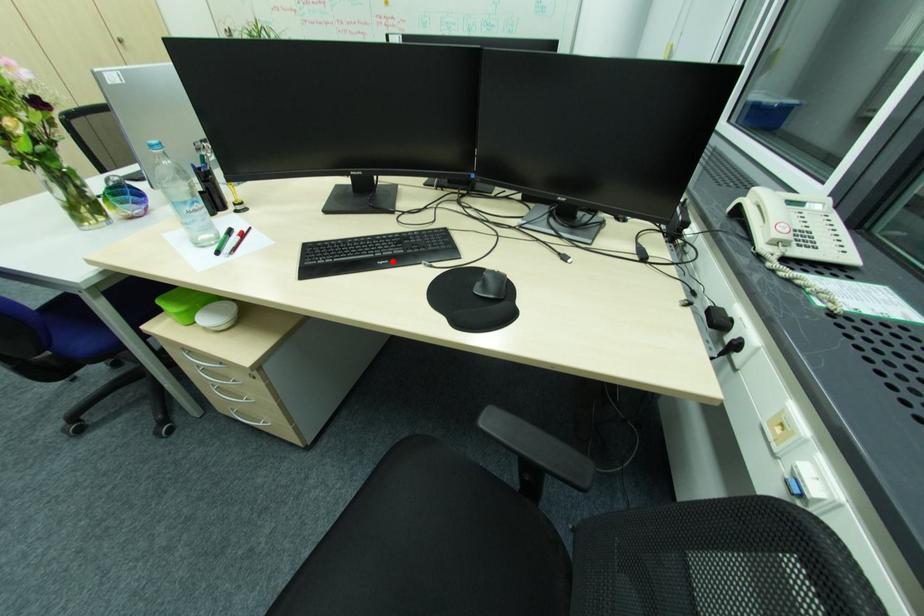
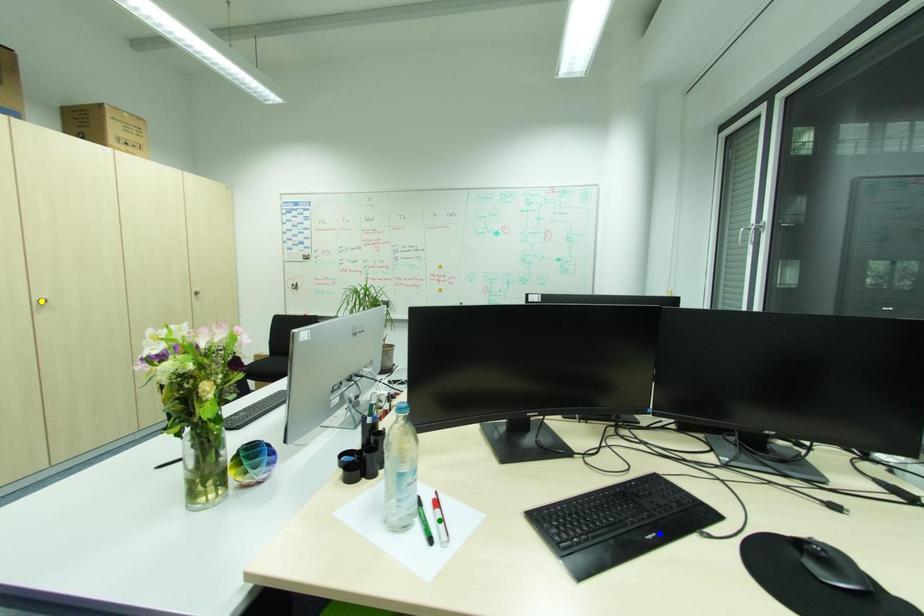
Question: I am providing you with two images of the same scene from different viewpoints. A red point is marked on the first image. You are given multiple points on the second image. Which point in image 2 represents the same 3d spot as the red point in image 1?

Choices:
 (A) green point
 (B) yellow point
 (C) blue point

Answer: (C)